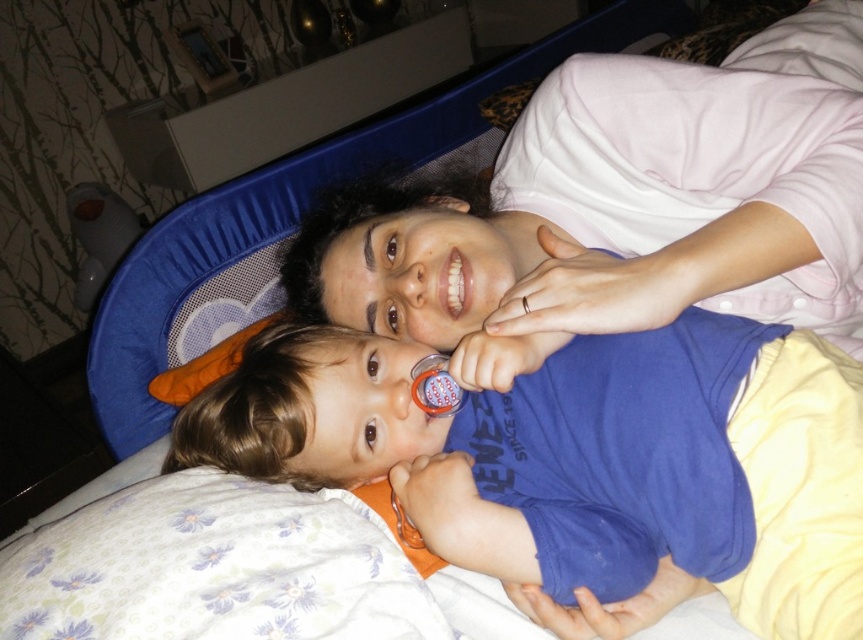
Question: Estimate the real-world distances between objects in this image. Which object is closer to the rubber teething ring at mouth?

Choices:
 (A) pink soft shirt at upper center
 (B) blue matte shirt at center

Answer: (B)

Question: Can you confirm if blue matte shirt at center is positioned to the left of white glossy teeth at center?

Choices:
 (A) yes
 (B) no

Answer: (A)

Question: Which is farther from the pink soft shirt at upper center?

Choices:
 (A) blue matte shirt at center
 (B) white glossy teeth at center
 (C) rubber teething ring at mouth

Answer: (C)

Question: Does white glossy teeth at center appear on the right side of rubber teething ring at mouth?

Choices:
 (A) yes
 (B) no

Answer: (B)

Question: Does blue matte shirt at center appear under pink soft shirt at upper center?

Choices:
 (A) no
 (B) yes

Answer: (B)

Question: Among these objects, which one is farthest from the camera?

Choices:
 (A) white glossy teeth at center
 (B) blue matte shirt at center
 (C) rubber teething ring at mouth

Answer: (A)